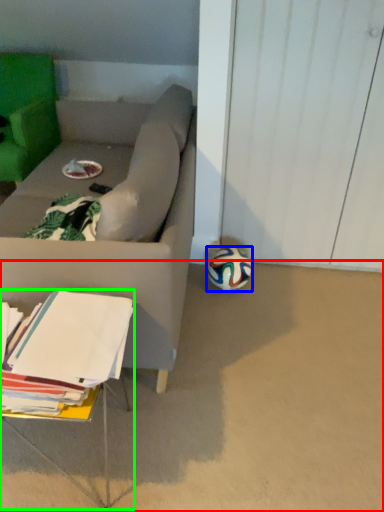
Question: Considering the real-world distances, which object is closest to concrete (highlighted by a red box)? ball (highlighted by a blue box) or table (highlighted by a green box).

Choices:
 (A) ball
 (B) table

Answer: (B)